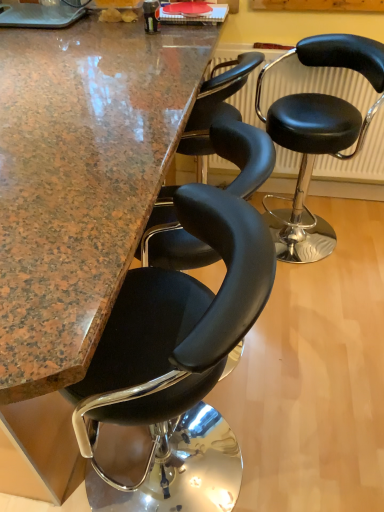
Image resolution: width=384 pixels, height=512 pixels. What do you see at coordinates (316, 84) in the screenshot? I see `black leather radiator at center` at bounding box center [316, 84].

At what (x,y) coordinates should I click in order to perform the action: click on black leather stool at center, the second chair when ordered from front to back. Please return your answer as a coordinate pair (x, y). The width and height of the screenshot is (384, 512). Looking at the image, I should click on (318, 134).

Considering the relative sizes of black leather stool at center, the 2th chair when ordered from right to left, and granite countertop at center in the image provided, is black leather stool at center, the 2th chair when ordered from right to left, wider than granite countertop at center?

No, black leather stool at center, the 2th chair when ordered from right to left, is not wider than granite countertop at center.

Is point (143, 320) closer or farther from the camera than point (126, 246)?

Point (143, 320) is farther from the camera than point (126, 246).

Looking at the image, does black leather stool at center, the 2th chair from the back, seem bigger or smaller compared to granite countertop at center?

black leather stool at center, the 2th chair from the back, is smaller than granite countertop at center.

Is there a large distance between black leather stool at center, arranged as the first chair when viewed from the front, and granite countertop at center?

black leather stool at center, arranged as the first chair when viewed from the front, is near granite countertop at center, not far away.

Which of these two, granite countertop at center or black leather stool at center, the second chair when ordered from front to back, is wider?

With larger width is granite countertop at center.

Is black leather stool at center, marked as the first chair in a right-to-left arrangement, at the back of granite countertop at center?

Absolutely, granite countertop at center is directed away from black leather stool at center, marked as the first chair in a right-to-left arrangement.

Is black leather stool at center, the 2th chair from the back, not close to black leather radiator at center?

Yes, black leather stool at center, the 2th chair from the back, and black leather radiator at center are quite far apart.

Which is behind, point (190, 325) or point (267, 54)?

The point (267, 54) is behind.

Between black leather stool at center, the 2th chair from the back, and black leather radiator at center, which one has less height?

Standing shorter between the two is black leather radiator at center.

Choose the correct answer: Is black leather stool at center, the 2th chair from the back, inside black leather radiator at center or outside it?

black leather stool at center, the 2th chair from the back, is outside black leather radiator at center.

Can you see black leather radiator at center touching black leather stool at center, the first chair in the left-to-right sequence?

No, black leather radiator at center is not next to black leather stool at center, the first chair in the left-to-right sequence.

Looking at this image, from the image's perspective, which object appears higher, black leather radiator at center or black leather stool at center, arranged as the first chair when viewed from the front?

From the image's view, black leather radiator at center is above.

Is black leather radiator at center spatially inside black leather stool at center, the 2th chair when ordered from right to left, or outside of it?

black leather radiator at center is not enclosed by black leather stool at center, the 2th chair when ordered from right to left.

You are a GUI agent. You are given a task and a screenshot of the screen. Output one action in this format:
    pyautogui.click(x=<x>, y=<y>)
    Task: Click on the radiator on the right of black leather stool at center, the first chair in the left-to-right sequence
    This screenshot has width=384, height=512.
    Given the screenshot: What is the action you would take?
    pyautogui.click(x=316, y=84)

From the image's perspective, which one is positioned lower, granite countertop at center or black leather stool at center, arranged as the first chair when viewed from the front?

black leather stool at center, arranged as the first chair when viewed from the front.

Between granite countertop at center and black leather stool at center, arranged as the first chair when viewed from the front, which one has smaller width?

With smaller width is black leather stool at center, arranged as the first chair when viewed from the front.

Is black leather stool at center, arranged as the first chair when viewed from the front, located within granite countertop at center?

Yes, black leather stool at center, arranged as the first chair when viewed from the front, is inside granite countertop at center.

Considering their positions, is granite countertop at center located in front of or behind black leather stool at center, the 2th chair from the back?

Clearly, granite countertop at center is in front of black leather stool at center, the 2th chair from the back.

Is granite countertop at center in contact with black leather radiator at center?

No, granite countertop at center is not next to black leather radiator at center.

Considering the positions of objects granite countertop at center and black leather radiator at center in the image provided, who is behind, granite countertop at center or black leather radiator at center?

black leather radiator at center is behind.

Which of these two, granite countertop at center or black leather radiator at center, stands taller?

granite countertop at center.

From the image's perspective, is granite countertop at center on top of black leather radiator at center?

No, from the image's perspective, granite countertop at center is not on top of black leather radiator at center.

In the image, is black leather stool at center, arranged as the first chair when viewed from the front, positioned in front of or behind black leather stool at center, placed as the first chair when sorted from back to front?

In the image, black leather stool at center, arranged as the first chair when viewed from the front, appears in front of black leather stool at center, placed as the first chair when sorted from back to front.

From the picture: Considering the relative sizes of black leather stool at center, the 2th chair from the back, and black leather stool at center, placed as the first chair when sorted from back to front, in the image provided, is black leather stool at center, the 2th chair from the back, bigger than black leather stool at center, placed as the first chair when sorted from back to front,?

Correct, black leather stool at center, the 2th chair from the back, is larger in size than black leather stool at center, placed as the first chair when sorted from back to front.

Considering the sizes of objects black leather stool at center, the 2th chair from the back, and black leather stool at center, the second chair when ordered from front to back, in the image provided, who is taller, black leather stool at center, the 2th chair from the back, or black leather stool at center, the second chair when ordered from front to back,?

With more height is black leather stool at center, the 2th chair from the back.

Considering the relative positions of black leather stool at center, the 2th chair from the back, and black leather stool at center, marked as the second chair in a left-to-right arrangement, in the image provided, is black leather stool at center, the 2th chair from the back, to the right of black leather stool at center, marked as the second chair in a left-to-right arrangement, from the viewer's perspective?

In fact, black leather stool at center, the 2th chair from the back, is to the left of black leather stool at center, marked as the second chair in a left-to-right arrangement.

The image size is (384, 512). In the image, there is a granite countertop at center. Identify the location of chair below it (from the image's perspective). coord(175,331).

Identify the location of countertop lying on the left of black leather stool at center, the second chair when ordered from front to back. The width and height of the screenshot is (384, 512). (80, 181).

Looking at the image, which one is located further to black leather radiator at center, granite countertop at center or black leather stool at center, placed as the first chair when sorted from back to front?

Based on the image, granite countertop at center appears to be further to black leather radiator at center.

Looking at the image, which one is located further to black leather stool at center, the 2th chair from the back, black leather stool at center, marked as the first chair in a right-to-left arrangement, or granite countertop at center?

black leather stool at center, marked as the first chair in a right-to-left arrangement, lies further to black leather stool at center, the 2th chair from the back, than the other object.

Estimate the real-world distances between objects in this image. Which object is closer to black leather stool at center, the 2th chair when ordered from right to left, black leather radiator at center or black leather stool at center, marked as the second chair in a left-to-right arrangement?

black leather stool at center, marked as the second chair in a left-to-right arrangement.

Based on the photo, when comparing their distances from granite countertop at center, does black leather stool at center, marked as the first chair in a right-to-left arrangement, or black leather stool at center, the 2th chair when ordered from right to left, seem closer?

black leather stool at center, the 2th chair when ordered from right to left.

Which object lies nearer to the anchor point granite countertop at center, black leather stool at center, the 2th chair when ordered from right to left, or black leather stool at center, marked as the first chair in a right-to-left arrangement?

black leather stool at center, the 2th chair when ordered from right to left.

Estimate the real-world distances between objects in this image. Which object is closer to black leather stool at center, arranged as the first chair when viewed from the front, granite countertop at center or black leather radiator at center?

granite countertop at center.

When comparing their distances from black leather radiator at center, does black leather stool at center, the 2th chair from the back, or black leather stool at center, placed as the first chair when sorted from back to front, seem further?

Based on the image, black leather stool at center, the 2th chair from the back, appears to be further to black leather radiator at center.

Consider the image. Looking at the image, which one is located closer to black leather stool at center, arranged as the first chair when viewed from the front, black leather radiator at center or granite countertop at center?

Based on the image, granite countertop at center appears to be nearer to black leather stool at center, arranged as the first chair when viewed from the front.

Where is `chair located between granite countertop at center and black leather stool at center, placed as the first chair when sorted from back to front, in the left-right direction`? This screenshot has height=512, width=384. chair located between granite countertop at center and black leather stool at center, placed as the first chair when sorted from back to front, in the left-right direction is located at coordinates (175, 331).

I want to click on chair between black leather stool at center, the 2th chair when ordered from right to left, and black leather radiator at center from front to back, so click(318, 134).